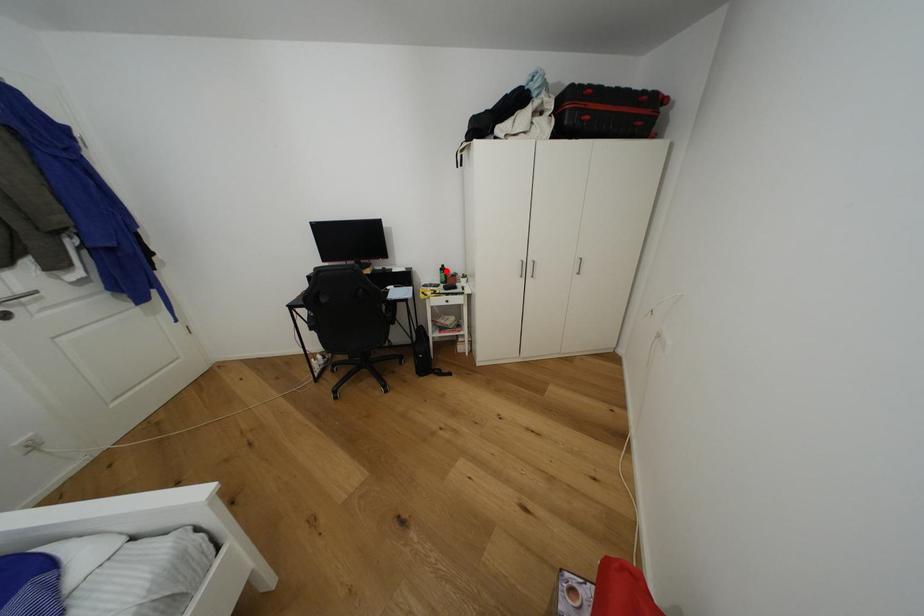
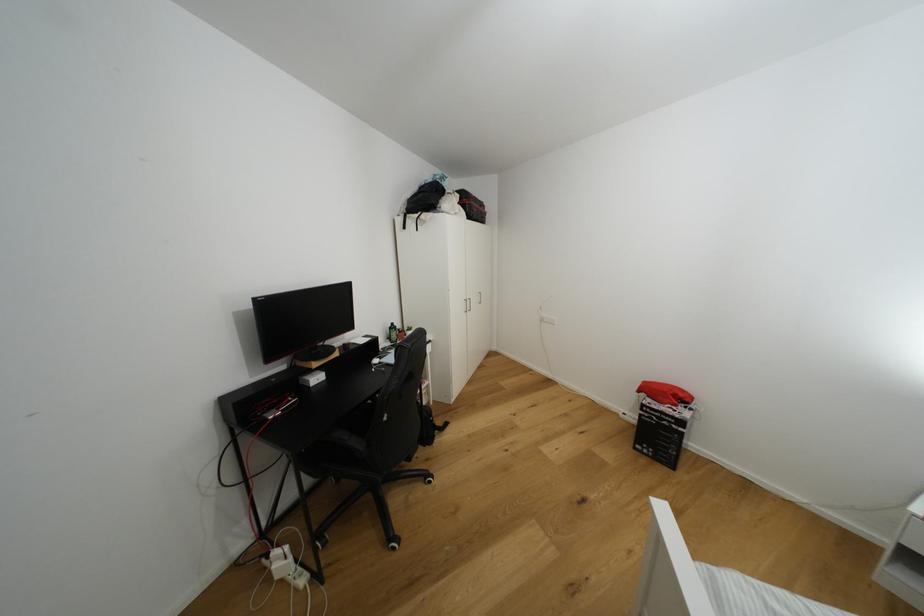
The point at the highlighted location is marked in the first image. Where is the corresponding point in the second image?

(395, 330)